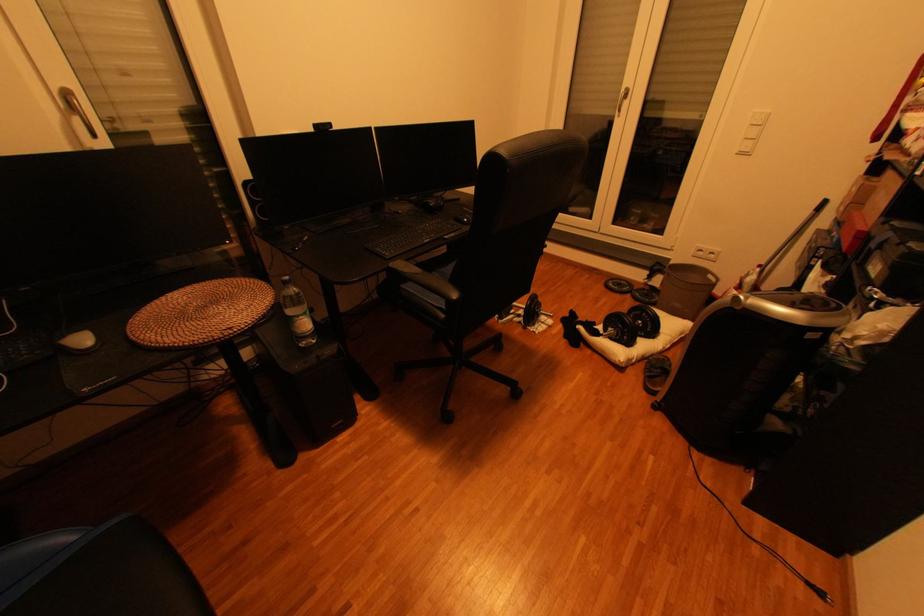
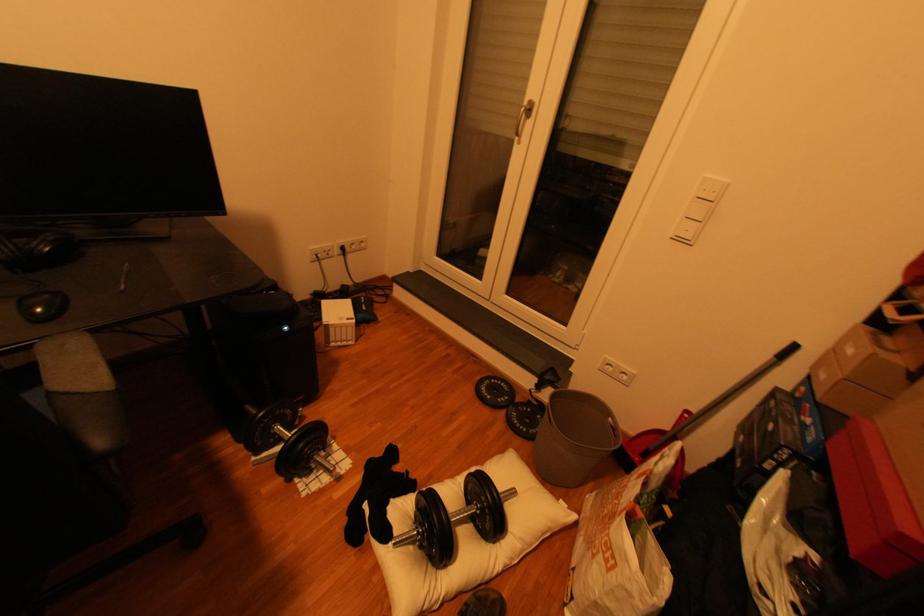
Locate, in the second image, the point that corresponds to (623,285) in the first image.

(497, 389)